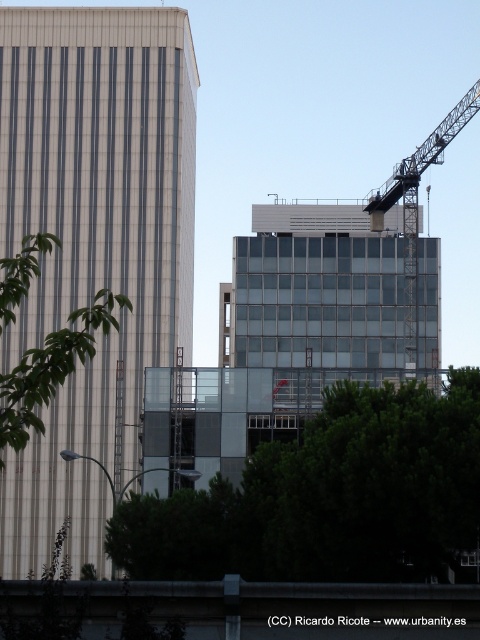
You are a city planner reviewing this urban layout. You need to determine if the white glass building at left will be shaded by the green leafy tree at center during the afternoon. Based on their positions, what do you conclude?

The white glass building at left is positioned under the green leafy tree at center, so it will be shaded by the tree during the afternoon.

A drone is flying at a point with coordinates point at (x=19, y=336). The drone needs to deliver a package to a location that is 129.09 meters away. Given the urban setting described, which building should the drone target for delivery?

The drone should target the construction site building in the center right because the point at (x=19, y=336) is 129.09 meters away from it.

You are standing in the urban scene and want to determine which of the two points, point (478, 470) or point (410, 316), is nearer to you. Based on the scene description, which point is closer?

Point (478, 470) is closer to the viewer than point (410, 316).